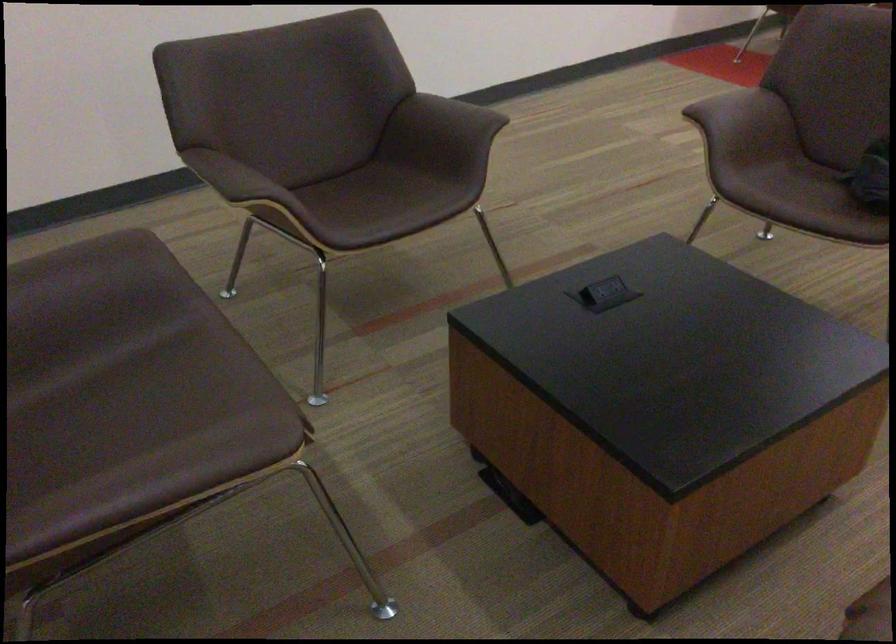
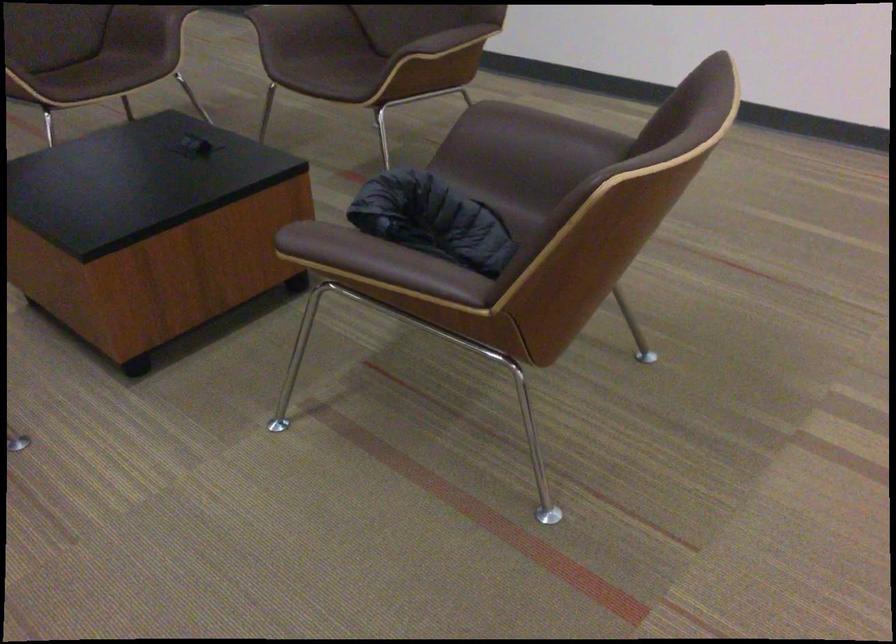
In the second image, find the point that corresponds to (x=738, y=96) in the first image.

(545, 128)